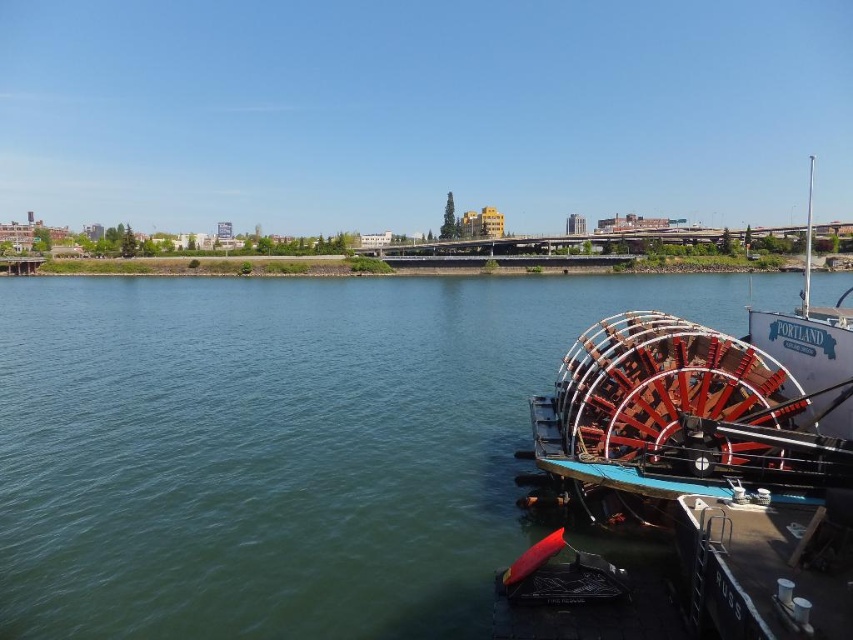
You are standing on the pier where the red polished wood paddlewheel at right is docked. You want to throw a pebble into the green smooth water at lower left. If you look down, which object appears closer to your feet?

The red polished wood paddlewheel at right is closer to your feet because it is docked at the pier, while the green smooth water at lower left is further away, as the water is much taller than the paddlewheel.

You are standing at the point marked by the coordinates point (283, 445) in the image, which is green smooth water at lower left. You want to walk to the paddlewheel boat docked at a pier on the right side. Which direction should you head to reach the boat?

The paddlewheel boat docked at a pier is on the right side of the image, so from the green smooth water at lower left, you should head towards the right to reach the boat.